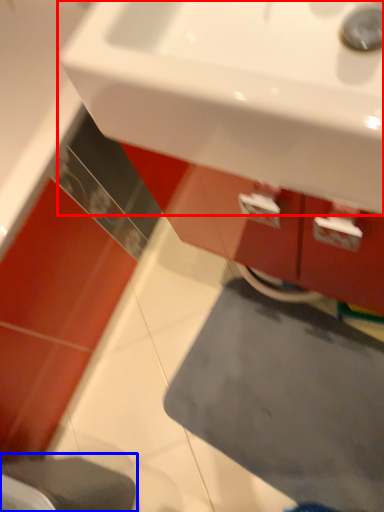
Question: Which object is further to the camera taking this photo, sink (highlighted by a red box) or step stool (highlighted by a blue box)?

Choices:
 (A) sink
 (B) step stool

Answer: (B)